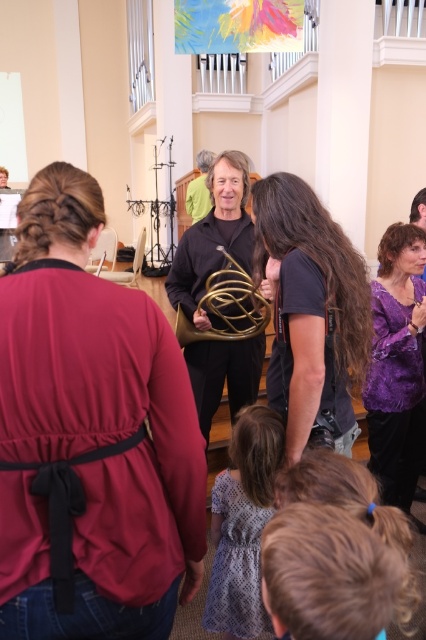
You are standing at point [215,294] and want to walk to the exit located at point [81,563]. Is the exit directly in front of you or behind you?

The exit at point [81,563] is in front of you because it is located in front of point [215,294] where you are standing.

You are standing at the entrance of the room and want to move towards the point labeled as point (279, 262). Which direction should you move relative to the point (379, 472)?

You should move towards the point (279, 262) which is in front of the point (379, 472).